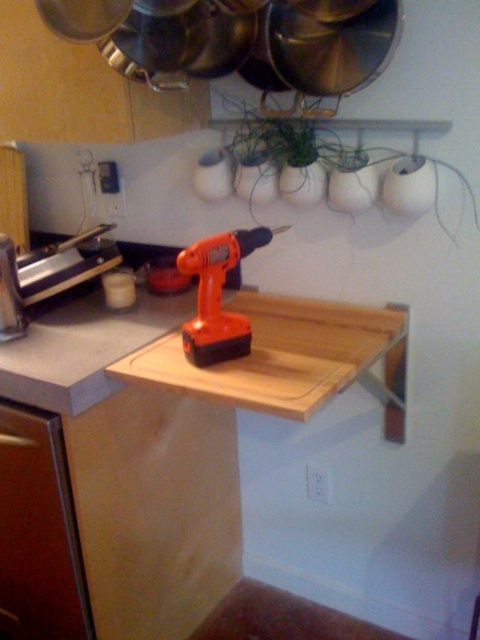
Question: Which point is farther to the camera?

Choices:
 (A) orange plastic drill at center
 (B) wooden cutting board at center

Answer: (A)

Question: Is wooden cutting board at center to the left of orange plastic drill at center from the viewer's perspective?

Choices:
 (A) yes
 (B) no

Answer: (A)

Question: Which of the following is the closest to the observer?

Choices:
 (A) orange plastic drill at center
 (B) wooden cutting board at center

Answer: (B)

Question: Is wooden cutting board at center to the right of orange plastic drill at center from the viewer's perspective?

Choices:
 (A) no
 (B) yes

Answer: (A)

Question: Is wooden cutting board at center closer to the viewer compared to orange plastic drill at center?

Choices:
 (A) no
 (B) yes

Answer: (B)